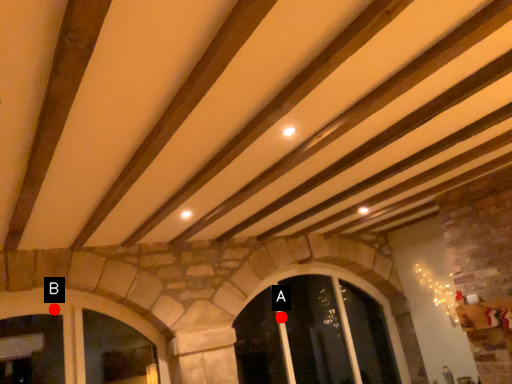
Question: Two points are circled on the image, labeled by A and B beside each circle. Which point is closer to the camera taking this photo?

Choices:
 (A) A is closer
 (B) B is closer

Answer: (B)